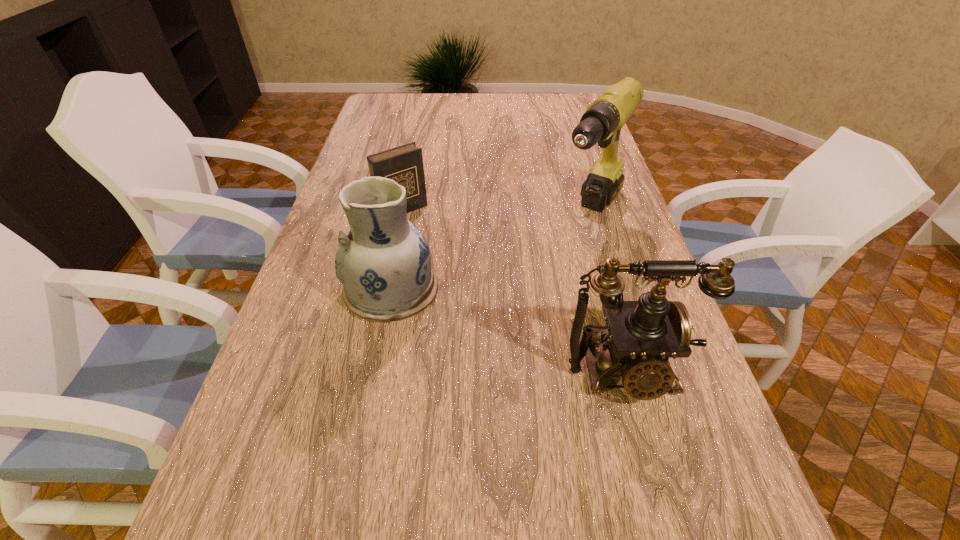
This screenshot has width=960, height=540. In order to click on free region at the far left corner in this screenshot , I will do `click(376, 114)`.

Find the location of a particular element. The image size is (960, 540). vacant space at the far right corner is located at coordinates (586, 107).

The image size is (960, 540). In order to click on empty space that is in between the nearest object and the diary in this screenshot , I will do (515, 291).

You are a GUI agent. You are given a task and a screenshot of the screen. Output one action in this format:
    pyautogui.click(x=<x>, y=<y>)
    Task: Click on the empty location between the telephone and the diary
    The width and height of the screenshot is (960, 540).
    Given the screenshot: What is the action you would take?
    pyautogui.click(x=515, y=291)

This screenshot has width=960, height=540. Identify the location of empty location between the drill and the pottery. (491, 251).

Identify the location of free space that is in between the second nearest object and the telephone. (508, 331).

Where is `vacant area that lies between the pottery and the drill`? The width and height of the screenshot is (960, 540). vacant area that lies between the pottery and the drill is located at coordinates (491, 251).

Identify the location of object that can be found as the second closest to the second nearest object. (642, 335).

The image size is (960, 540). In order to click on object that is the third closest to the drill in this screenshot , I will do `click(404, 164)`.

This screenshot has width=960, height=540. I want to click on free spot that satisfies the following two spatial constraints: 1. on the back side of the drill; 2. on the right side of the second nearest object, so [406, 213].